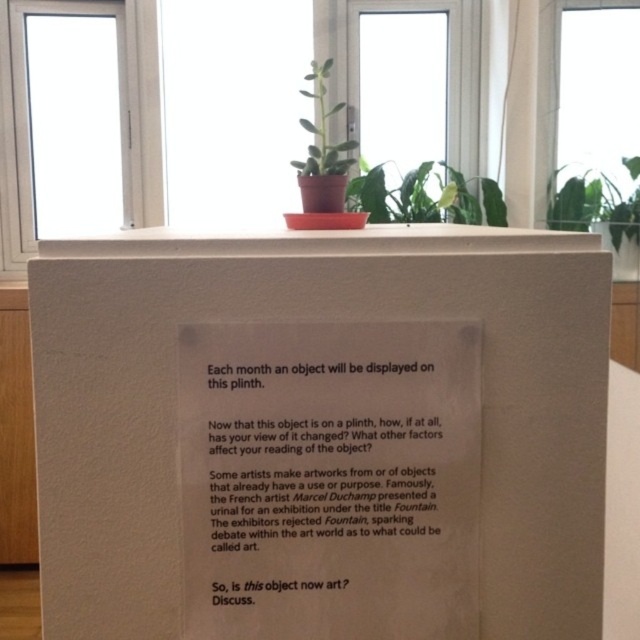
Is white glass window at upper left wider than green matte leafy plant at center?

Indeed, white glass window at upper left has a greater width compared to green matte leafy plant at center.

Who is higher up, white glass window at upper left or green matte leafy plant at center?

white glass window at upper left is higher up.

Which is in front, point (4, 96) or point (492, 204)?

Point (492, 204)

I want to click on white glass window at upper left, so click(x=122, y=122).

Can you confirm if white matte paper at center is shorter than transparent glass window at upper center?

Indeed, white matte paper at center has a lesser height compared to transparent glass window at upper center.

Is point (488, 465) farther from camera compared to point (612, 138)?

No, it is not.

This screenshot has width=640, height=640. Find the location of `white matte paper at center`. white matte paper at center is located at coordinates (321, 435).

This screenshot has height=640, width=640. In order to click on white matte paper at center in this screenshot , I will do `click(321, 435)`.

Which is in front, point (387, 220) or point (560, 200)?

Point (560, 200) is more forward.

Who is lower down, green matte leafy plant at center or green leafy plant at upper center?

green leafy plant at upper center

This screenshot has width=640, height=640. What do you see at coordinates (424, 196) in the screenshot? I see `green matte leafy plant at center` at bounding box center [424, 196].

The height and width of the screenshot is (640, 640). In order to click on green matte leafy plant at center in this screenshot , I will do `click(424, 196)`.